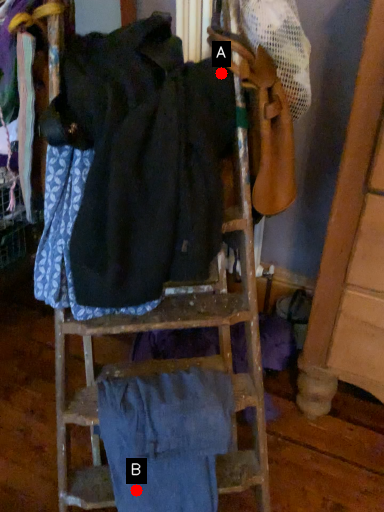
Question: Two points are circled on the image, labeled by A and B beside each circle. Which of the following is the farthest from the observer?

Choices:
 (A) A is further
 (B) B is further

Answer: (B)